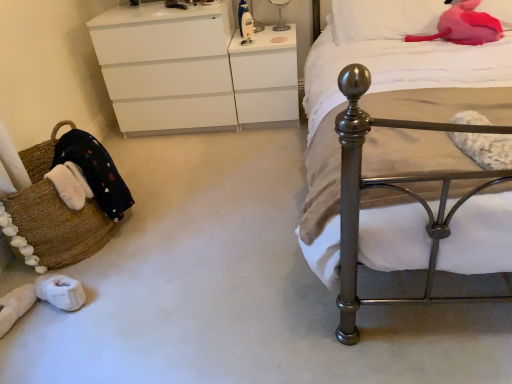
Question: Does polished metal bed at right have a greater height compared to transparent glass lamp at upper center?

Choices:
 (A) no
 (B) yes

Answer: (B)

Question: Are polished metal bed at right and transparent glass lamp at upper center located far from each other?

Choices:
 (A) yes
 (B) no

Answer: (A)

Question: Could transparent glass lamp at upper center be considered to be inside polished metal bed at right?

Choices:
 (A) yes
 (B) no

Answer: (B)

Question: From a real-world perspective, is polished metal bed at right physically above transparent glass lamp at upper center?

Choices:
 (A) yes
 (B) no

Answer: (B)

Question: Does polished metal bed at right have a greater width compared to transparent glass lamp at upper center?

Choices:
 (A) no
 (B) yes

Answer: (B)

Question: From the image's perspective, is polished metal bed at right under transparent glass lamp at upper center?

Choices:
 (A) yes
 (B) no

Answer: (A)

Question: From a real-world perspective, is pink plush at upper right, positioned as the 1th pillow in left-to-right order, located beneath polished metal bed at right?

Choices:
 (A) yes
 (B) no

Answer: (B)

Question: From the image's perspective, is pink plush at upper right, positioned as the 1th pillow in left-to-right order, over polished metal bed at right?

Choices:
 (A) no
 (B) yes

Answer: (B)

Question: Is pink plush at upper right, placed as the second pillow when sorted from right to left, further to the viewer compared to polished metal bed at right?

Choices:
 (A) no
 (B) yes

Answer: (B)

Question: Considering the relative sizes of pink plush at upper right, positioned as the 1th pillow in left-to-right order, and polished metal bed at right in the image provided, is pink plush at upper right, positioned as the 1th pillow in left-to-right order, taller than polished metal bed at right?

Choices:
 (A) no
 (B) yes

Answer: (A)

Question: Is pink plush at upper right, placed as the second pillow when sorted from right to left, looking in the opposite direction of polished metal bed at right?

Choices:
 (A) no
 (B) yes

Answer: (B)

Question: Can you see pink plush at upper right, positioned as the 1th pillow in left-to-right order, touching polished metal bed at right?

Choices:
 (A) no
 (B) yes

Answer: (A)

Question: From the image's perspective, would you say polished metal bed at right is shown under white glossy changing table at upper center?

Choices:
 (A) yes
 (B) no

Answer: (A)